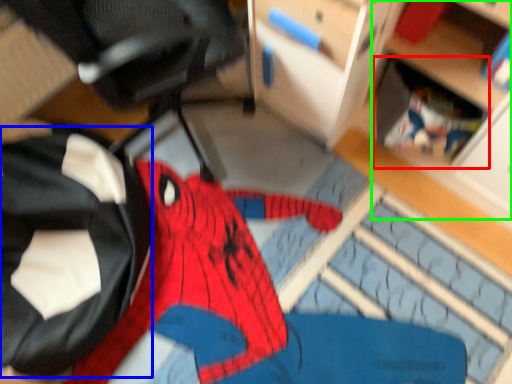
Question: Considering the real-world distances, which object is farthest from shelf (highlighted by a red box)? clothing (highlighted by a blue box) or shelf (highlighted by a green box)?

Choices:
 (A) clothing
 (B) shelf

Answer: (A)